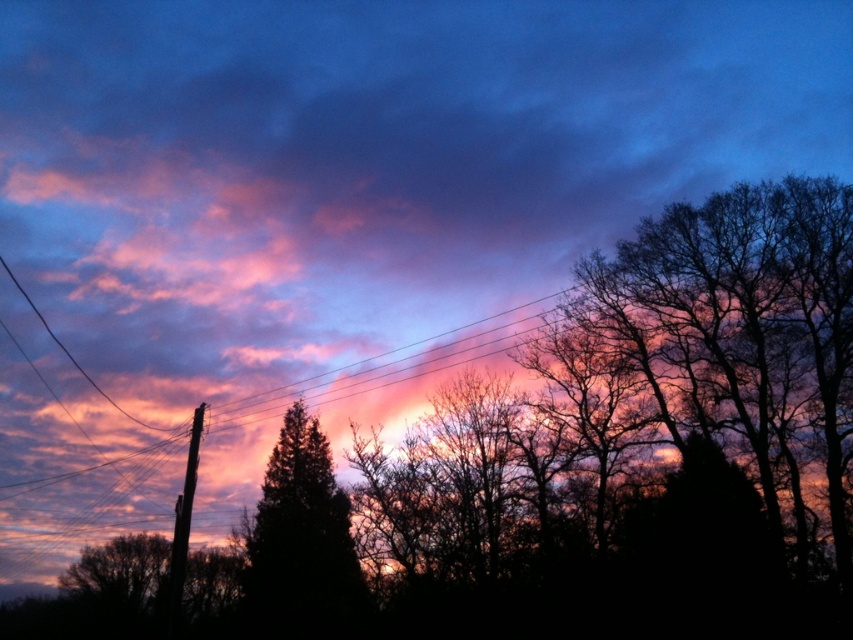
Is the position of green matte tree at center more distant than that of brown wooden telegraph pole at left?

Yes, it is behind brown wooden telegraph pole at left.

Between green matte tree at center and brown wooden telegraph pole at left, which one appears on the left side from the viewer's perspective?

Positioned to the left is brown wooden telegraph pole at left.

The image size is (853, 640). Describe the element at coordinates (302, 544) in the screenshot. I see `green matte tree at center` at that location.

Locate an element on the screen. The image size is (853, 640). green matte tree at center is located at coordinates (302, 544).